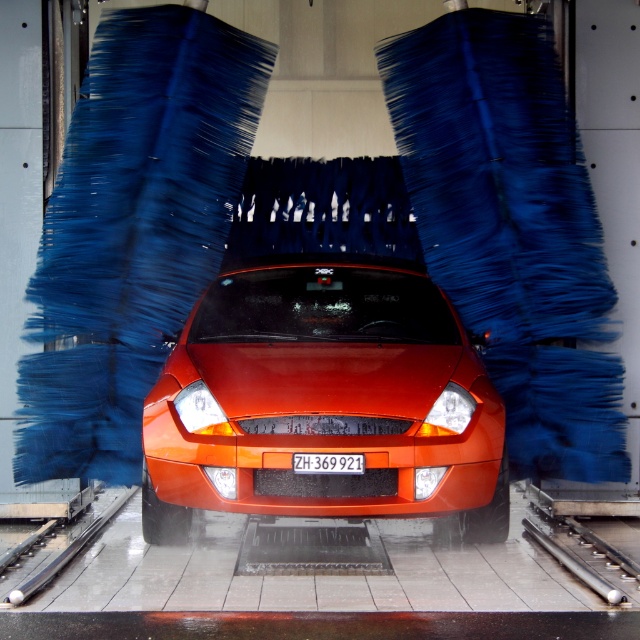
Question: Can you confirm if orange matte car at center is bigger than white plastic license plate at center?

Choices:
 (A) no
 (B) yes

Answer: (B)

Question: Which point is closer to the camera taking this photo?

Choices:
 (A) (321, 461)
 (B) (392, 412)

Answer: (A)

Question: Is orange matte car at center thinner than white plastic license plate at center?

Choices:
 (A) no
 (B) yes

Answer: (A)

Question: Which point appears closest to the camera in this image?

Choices:
 (A) (465, 468)
 (B) (352, 467)

Answer: (B)

Question: Can you confirm if orange matte car at center is positioned to the left of white plastic license plate at center?

Choices:
 (A) no
 (B) yes

Answer: (B)